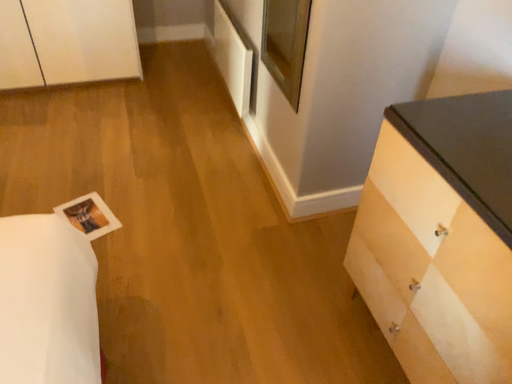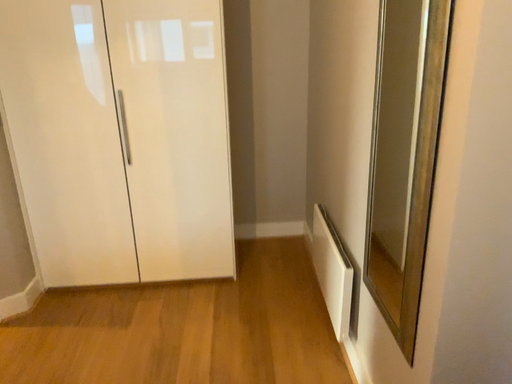
Question: How did the camera likely rotate when shooting the video?

Choices:
 (A) rotated right
 (B) rotated left

Answer: (B)